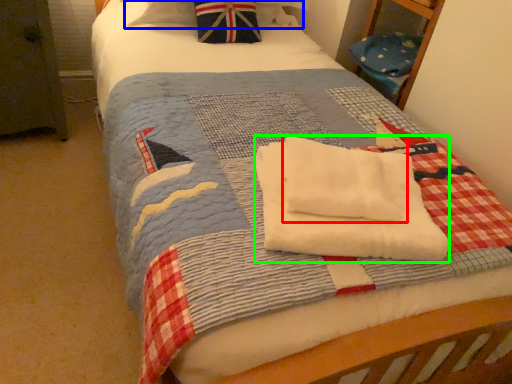
Question: Estimate the real-world distances between objects in this image. Which object is farther from beach towel (highlighted by a red box), pillow (highlighted by a blue box) or beach towel (highlighted by a green box)?

Choices:
 (A) pillow
 (B) beach towel

Answer: (A)